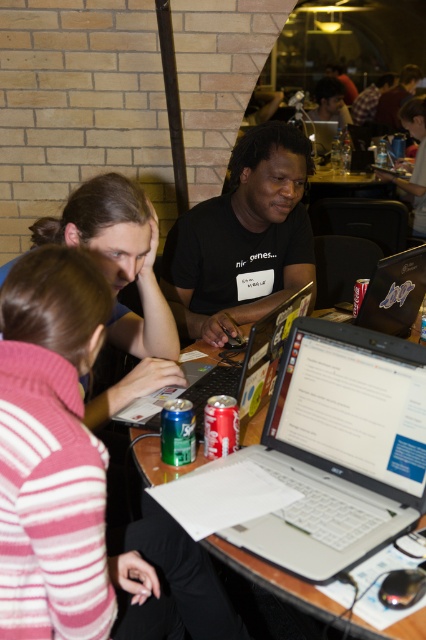
You are a person sitting at the wooden table at center. You want to grab the glossy plastic laptop at center which is on the table. Which direction should you reach towards to get it?

The glossy plastic laptop at center is on the right side of the wooden table at center, so you should reach towards the right to grab it.

Looking at this image, you are organizing a small tech meetup and need to place a 12 inch wide projector between the wooden table at center and the silver metallic laptop at center. Given the space between them, can the projector fit without overlapping either object?

The wooden table at center is wider than the silver metallic laptop at center. However, the description does not specify the exact distance between them, so we cannot determine if the 12 inch projector will fit without overlapping. Additional spatial information about their positioning is needed.

You are a person who wants to place a 10 cm tall coffee mug on the wooden table at center. Can you determine if the mug will fit on the table without touching the glossy plastic laptop at center?

The wooden table at center has a lesser height compared to glossy plastic laptop at center. Since the table is shorter than the laptop, placing the 10 cm tall coffee mug on the table might cause it to be lower than the laptop, but the height difference alone doesn